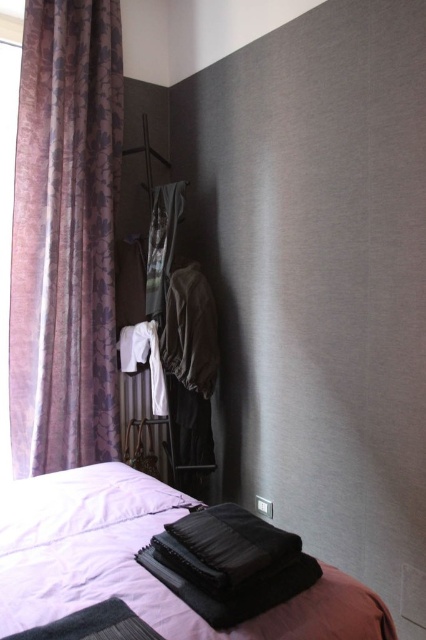
Question: Is brown textured curtain at left to the right of matte black suitcase at lower center from the viewer's perspective?

Choices:
 (A) yes
 (B) no

Answer: (B)

Question: Which of the following is the closest to the observer?

Choices:
 (A) (134, 481)
 (B) (249, 547)

Answer: (B)

Question: Estimate the real-world distances between objects in this image. Which object is closer to the black matte pillow at lower center?

Choices:
 (A) matte black suitcase at lower center
 (B) white soft pillow at lower left
 (C) brown textured curtain at left

Answer: (A)

Question: Is matte black suitcase at lower center above white soft pillow at lower left?

Choices:
 (A) yes
 (B) no

Answer: (B)

Question: Is white soft pillow at lower left to the left of black matte pillow at lower center from the viewer's perspective?

Choices:
 (A) yes
 (B) no

Answer: (A)

Question: Based on their relative distances, which object is nearer to the matte black suitcase at lower center?

Choices:
 (A) white soft pillow at lower left
 (B) brown textured curtain at left

Answer: (A)